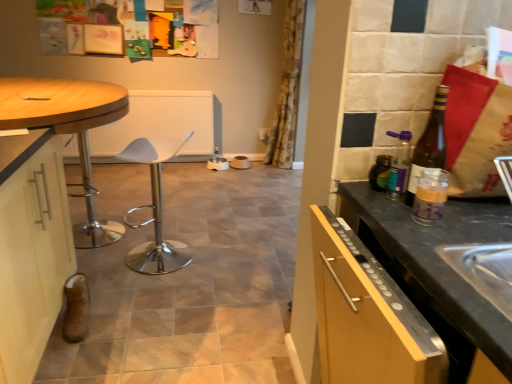
Question: From a real-world perspective, is wooden polished table at left under white plastic bar stool at center?

Choices:
 (A) yes
 (B) no

Answer: (B)

Question: From a real-world perspective, is wooden polished table at left located higher than white plastic bar stool at center?

Choices:
 (A) no
 (B) yes

Answer: (B)

Question: Is the position of wooden polished table at left less distant than that of white plastic bar stool at center?

Choices:
 (A) yes
 (B) no

Answer: (A)

Question: From the image's perspective, is wooden polished table at left located beneath white plastic bar stool at center?

Choices:
 (A) yes
 (B) no

Answer: (B)

Question: Considering the relative positions of wooden polished table at left and white plastic bar stool at center in the image provided, is wooden polished table at left to the right of white plastic bar stool at center from the viewer's perspective?

Choices:
 (A) yes
 (B) no

Answer: (B)

Question: From the image's perspective, is white plastic bar stool at center located above or below wooden polished table at left?

Choices:
 (A) above
 (B) below

Answer: (B)

Question: Considering the relative positions of white plastic bar stool at center and wooden polished table at left in the image provided, is white plastic bar stool at center to the left or to the right of wooden polished table at left?

Choices:
 (A) right
 (B) left

Answer: (A)

Question: Looking at the image, does white plastic bar stool at center seem bigger or smaller compared to wooden polished table at left?

Choices:
 (A) small
 (B) big

Answer: (A)

Question: From a real-world perspective, relative to wooden polished table at left, is white plastic bar stool at center vertically above or below?

Choices:
 (A) above
 (B) below

Answer: (B)

Question: Visually, is floral fabric curtain at center positioned to the left or to the right of wooden polished table at left?

Choices:
 (A) right
 (B) left

Answer: (A)

Question: From a real-world perspective, relative to wooden polished table at left, is floral fabric curtain at center vertically above or below?

Choices:
 (A) below
 (B) above

Answer: (B)

Question: In terms of size, does floral fabric curtain at center appear bigger or smaller than wooden polished table at left?

Choices:
 (A) big
 (B) small

Answer: (B)

Question: Which is correct: floral fabric curtain at center is inside wooden polished table at left, or outside of it?

Choices:
 (A) outside
 (B) inside

Answer: (A)

Question: In terms of width, does matte white cabinet at left look wider or thinner when compared to translucent glass bottle at right, acting as the 2th bottle starting from the back?

Choices:
 (A) wide
 (B) thin

Answer: (A)

Question: Choose the correct answer: Is matte white cabinet at left inside translucent glass bottle at right, acting as the 2th bottle starting from the front, or outside it?

Choices:
 (A) inside
 (B) outside

Answer: (B)